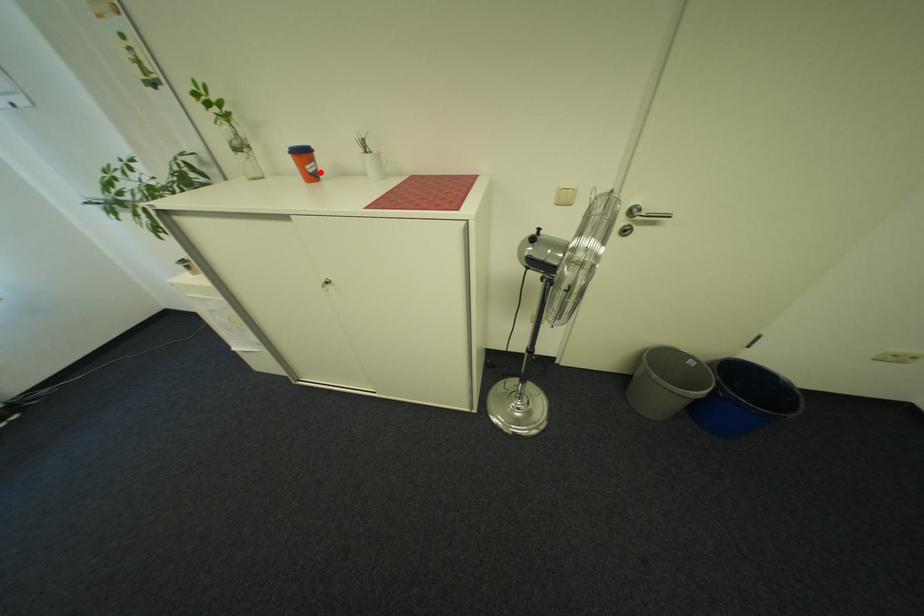
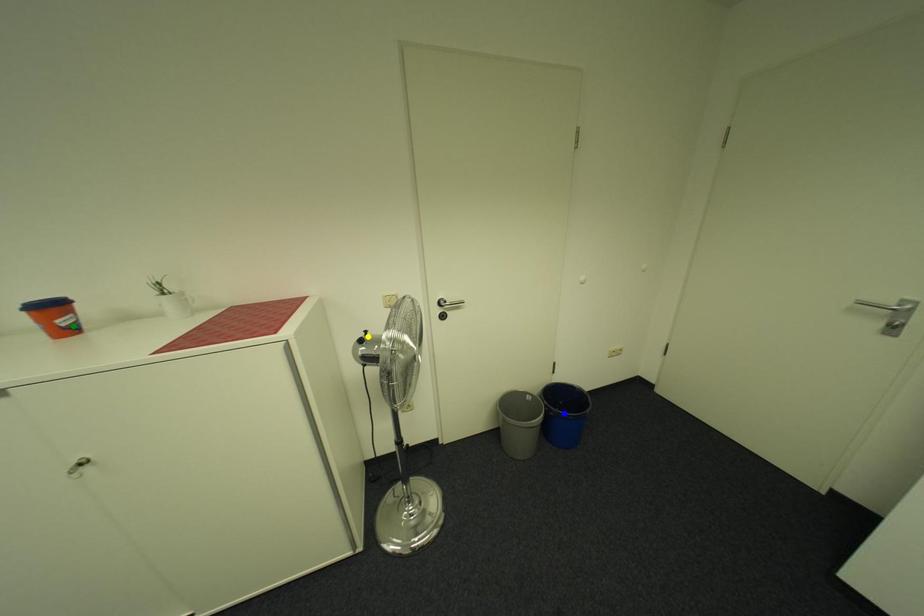
Question: I am providing you with two images of the same scene from different viewpoints. A red point is marked on the first image. You are given multiple points on the second image. In image 2, which mark is for the same physical point as the one in image 1?

Choices:
 (A) yellow point
 (B) green point
 (C) blue point

Answer: (B)